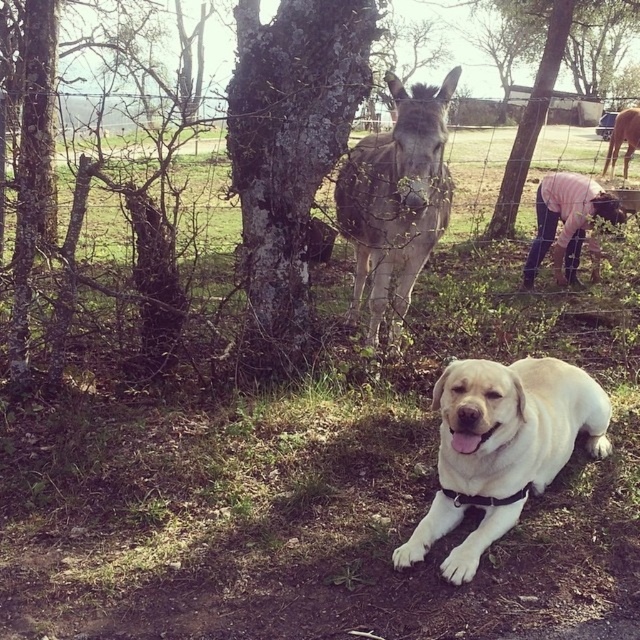
Which of these two, dark gray bark tree at center or yellow matte dog at lower center, stands shorter?

Standing shorter between the two is yellow matte dog at lower center.

Between point (289, 273) and point (497, 365), which one is positioned in front?

Point (497, 365) is more forward.

What do you see at coordinates (289, 150) in the screenshot?
I see `dark gray bark tree at center` at bounding box center [289, 150].

I want to click on dark gray bark tree at center, so point(289,150).

Does smooth bark tree at center have a larger size compared to brown fur horse at upper right?

Yes.

Which is more to the right, smooth bark tree at center or brown fur horse at upper right?

brown fur horse at upper right is more to the right.

The height and width of the screenshot is (640, 640). What are the coordinates of `smooth bark tree at center` in the screenshot? It's located at (289, 154).

Can you confirm if dark gray bark tree at center is bigger than grayish-brown fur at center?

Actually, dark gray bark tree at center might be smaller than grayish-brown fur at center.

What do you see at coordinates (289, 150) in the screenshot?
I see `dark gray bark tree at center` at bounding box center [289, 150].

This screenshot has width=640, height=640. Identify the location of dark gray bark tree at center. (289, 150).